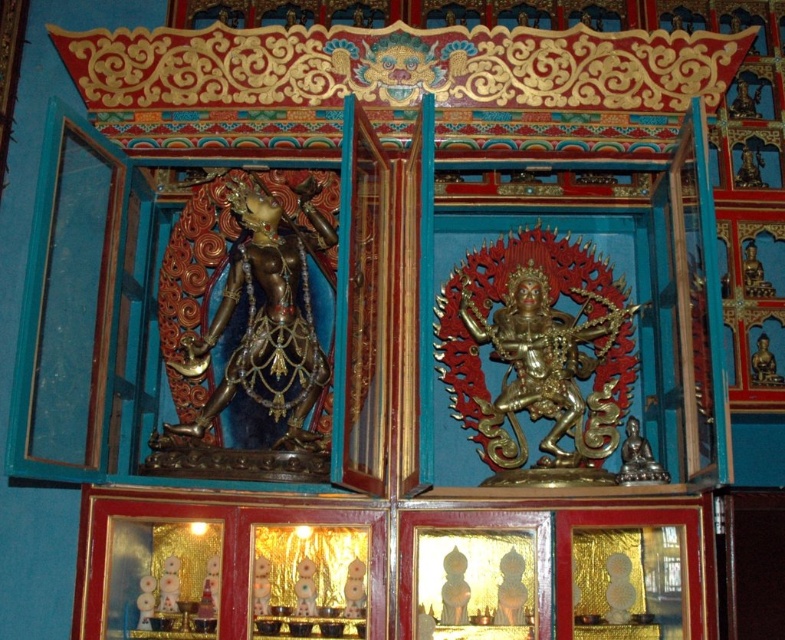
You are an architect designing a new temple and want to place a golden statue in the exact same position as the gold metallic statue at center in the image. What are the coordinates for placing the statue?

The coordinates for placing the gold metallic statue at center should be at point (537, 349).

You are standing in front of the shrine and want to take a closer look at the gold metallic statue at center. Considering the statue is 143.31 feet away from you, can you estimate how far you need to walk to reach it?

The gold metallic statue at center is 143.31 feet away from the viewer, so you need to walk approximately 143.31 feet to reach it.